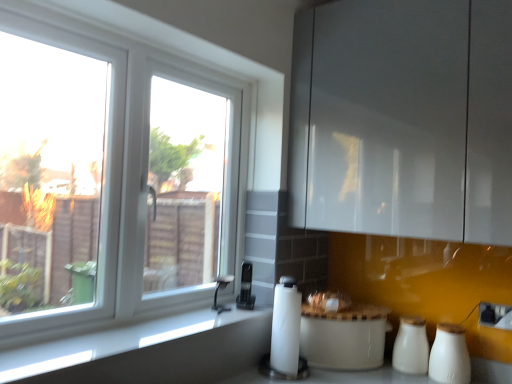
Question: Looking at the image, does black plastic phone at center, positioned as the first appliance in top-to-bottom order, seem bigger or smaller compared to white plastic window at left?

Choices:
 (A) big
 (B) small

Answer: (B)

Question: Would you say black plastic phone at center, the second appliance positioned from the bottom, is inside or outside white plastic window at left?

Choices:
 (A) inside
 (B) outside

Answer: (B)

Question: Which object is positioned closest to the white ceramic salt shaker at lower right, positioned as the 2th salt shaker in back-to-front order?

Choices:
 (A) black plastic phone at center, the second appliance positioned from the bottom
 (B) white matte paper towel at lower center
 (C) white plastic window at left
 (D) white matte salt shaker at lower right, which appears as the second salt shaker when viewed from the front
 (E) white glossy rice cooker at center, the 1th appliance positioned from the bottom

Answer: (D)

Question: Considering the real-world distances, which object is closest to the white ceramic salt shaker at lower right, positioned as the 2th salt shaker in back-to-front order?

Choices:
 (A) white matte salt shaker at lower right, which is counted as the 1th salt shaker, starting from the back
 (B) satin nickel faucet at lower center
 (C) white glossy rice cooker at center, the 1th appliance positioned from the bottom
 (D) smooth gray countertop at lower left
 (E) black plastic phone at center, the second appliance positioned from the bottom

Answer: (A)